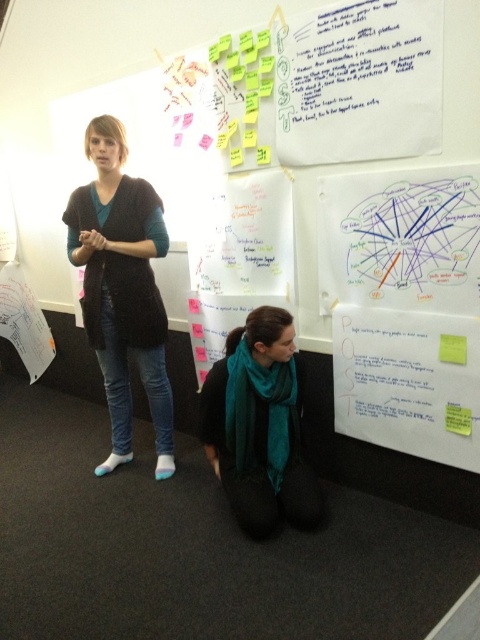
Question: Which point appears closest to the camera in this image?

Choices:
 (A) (226, 460)
 (B) (446, 410)
 (C) (133, 184)

Answer: (B)

Question: Which point is closer to the camera taking this photo?

Choices:
 (A) (448, 355)
 (B) (276, 444)

Answer: (A)

Question: Is teal scarf at lower center further to camera compared to yellow sticky note at upper right?

Choices:
 (A) yes
 (B) no

Answer: (A)

Question: From the image, what is the correct spatial relationship of teal scarf at lower center in relation to yellow sticky note at upper right?

Choices:
 (A) above
 (B) below

Answer: (B)

Question: From the image, what is the correct spatial relationship of white paper at upper center in relation to teal scarf at lower center?

Choices:
 (A) above
 (B) below

Answer: (A)

Question: Which object appears closest to the camera in this image?

Choices:
 (A) white paper at upper center
 (B) yellow paper at lower right

Answer: (A)